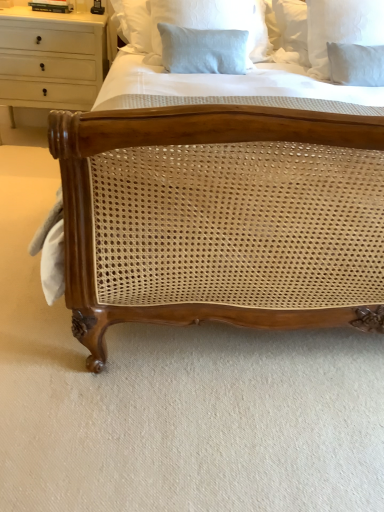
Question: Is white linen pillow at upper right, arranged as the 2th pillow when viewed from the left, next to white wood chest of drawers at upper left and touching it?

Choices:
 (A) yes
 (B) no

Answer: (B)

Question: Is white linen pillow at upper right, arranged as the 2th pillow when viewed from the left, aimed at white wood chest of drawers at upper left?

Choices:
 (A) no
 (B) yes

Answer: (A)

Question: Does white linen pillow at upper right, arranged as the 2th pillow when viewed from the left, come in front of white wood chest of drawers at upper left?

Choices:
 (A) no
 (B) yes

Answer: (B)

Question: Is white linen pillow at upper right, which is counted as the 1th pillow, starting from the right, to the right of white wood chest of drawers at upper left from the viewer's perspective?

Choices:
 (A) yes
 (B) no

Answer: (A)

Question: Is white linen pillow at upper right, which is counted as the 1th pillow, starting from the right, bigger or smaller than light blue linen pillow at upper center, arranged as the 2th pillow when viewed from the right?

Choices:
 (A) big
 (B) small

Answer: (B)

Question: From a real-world perspective, is white linen pillow at upper right, arranged as the 2th pillow when viewed from the left, positioned above or below light blue linen pillow at upper center, arranged as the 2th pillow when viewed from the right?

Choices:
 (A) above
 (B) below

Answer: (B)

Question: Which is correct: white linen pillow at upper right, arranged as the 2th pillow when viewed from the left, is inside light blue linen pillow at upper center, arranged as the 2th pillow when viewed from the right, or outside of it?

Choices:
 (A) outside
 (B) inside

Answer: (A)

Question: Based on their positions, is white linen pillow at upper right, which is counted as the 1th pillow, starting from the right, located to the left or right of light blue linen pillow at upper center, the 1th pillow from the left?

Choices:
 (A) right
 (B) left

Answer: (A)

Question: From a real-world perspective, is light blue linen pillow at upper center, the 1th pillow from the left, physically located above or below white linen pillow at upper right, arranged as the 2th pillow when viewed from the left?

Choices:
 (A) below
 (B) above

Answer: (B)

Question: Is light blue linen pillow at upper center, the 1th pillow from the left, in front of or behind white linen pillow at upper right, which is counted as the 1th pillow, starting from the right, in the image?

Choices:
 (A) behind
 (B) front

Answer: (B)

Question: In terms of height, does light blue linen pillow at upper center, the 1th pillow from the left, look taller or shorter compared to white linen pillow at upper right, which is counted as the 1th pillow, starting from the right?

Choices:
 (A) tall
 (B) short

Answer: (B)

Question: Is light blue linen pillow at upper center, arranged as the 2th pillow when viewed from the right, bigger or smaller than white linen pillow at upper right, which is counted as the 1th pillow, starting from the right?

Choices:
 (A) small
 (B) big

Answer: (B)

Question: Is white wood chest of drawers at upper left taller or shorter than light blue linen pillow at upper center, arranged as the 2th pillow when viewed from the right?

Choices:
 (A) short
 (B) tall

Answer: (B)

Question: In the image, is white wood chest of drawers at upper left on the left side or the right side of light blue linen pillow at upper center, the 1th pillow from the left?

Choices:
 (A) left
 (B) right

Answer: (A)